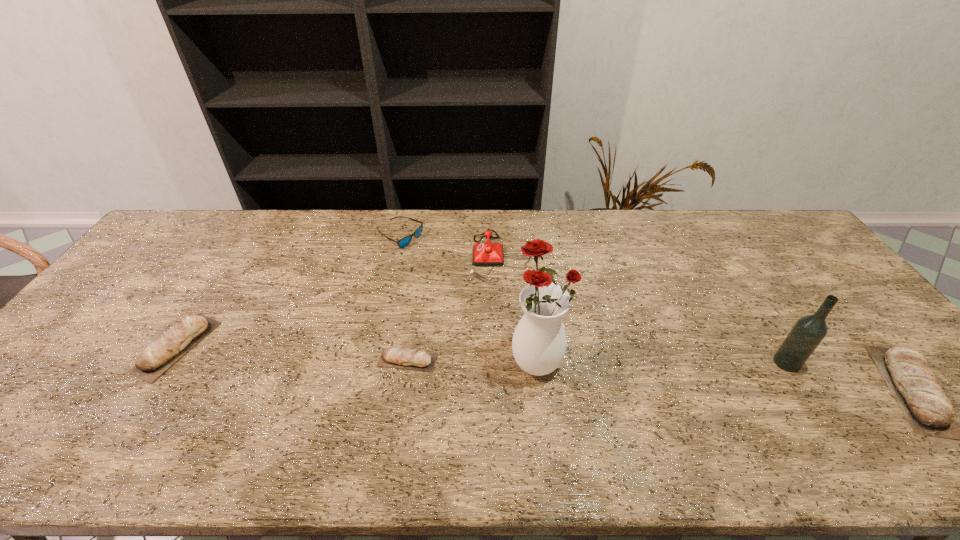
The image size is (960, 540). I want to click on the leftmost pita bread, so click(156, 358).

Locate an element on the screen. the second shortest pita bread is located at coordinates (156, 358).

Identify the location of the second pita bread from right to left. This screenshot has width=960, height=540. (404, 358).

Where is `the shortest object`? the shortest object is located at coordinates point(404,358).

I want to click on sunglasses, so click(405, 241).

Where is `the fifth shortest object`? The image size is (960, 540). the fifth shortest object is located at coordinates (484, 254).

Where is `the sixth shortest object`? the sixth shortest object is located at coordinates (808, 332).

Identify the location of vodka. The width and height of the screenshot is (960, 540). (808, 332).

I want to click on the tallest object, so click(539, 342).

I want to click on vacant point located on the back of the third shortest object, so click(x=250, y=234).